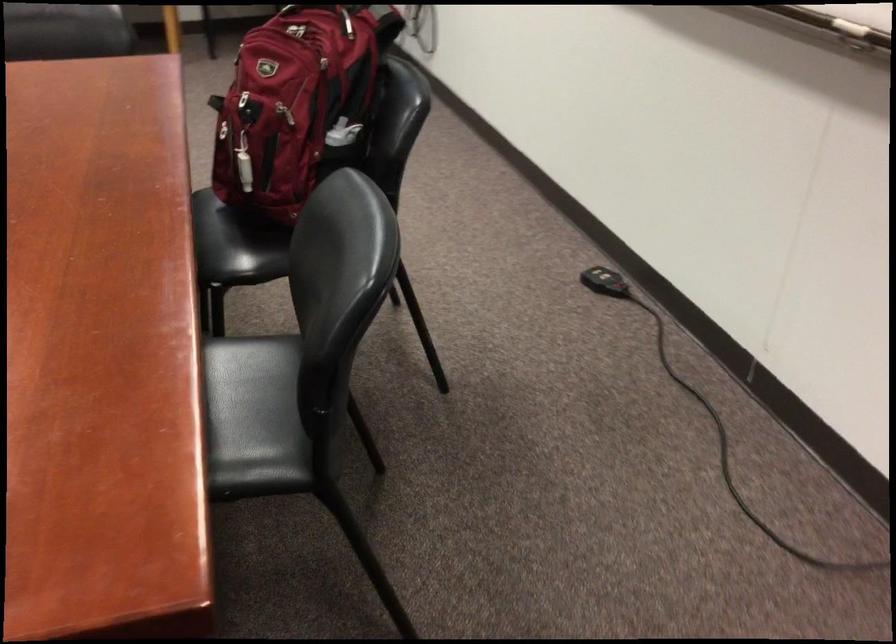
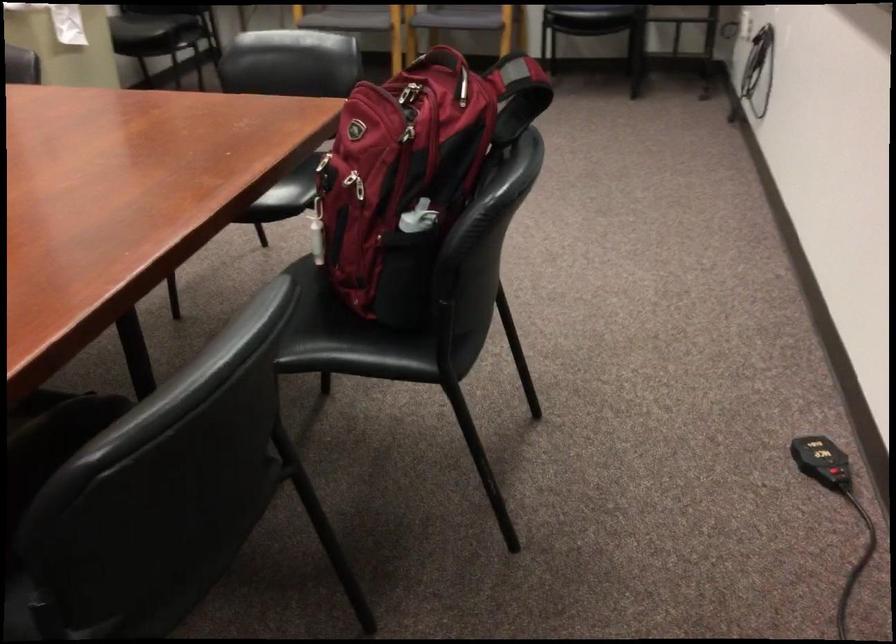
Where in the second image is the point corresponding to (319,67) from the first image?

(412, 136)